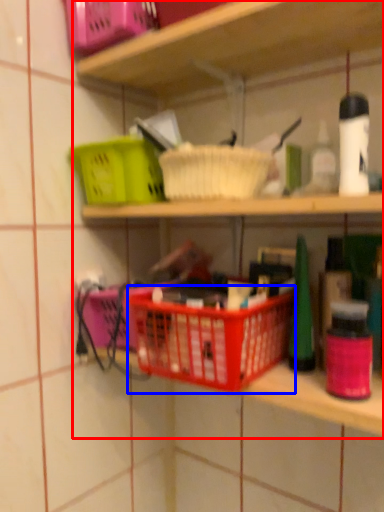
Question: Among these objects, which one is nearest to the camera, shelf (highlighted by a red box) or basket container (highlighted by a blue box)?

Choices:
 (A) shelf
 (B) basket container

Answer: (A)